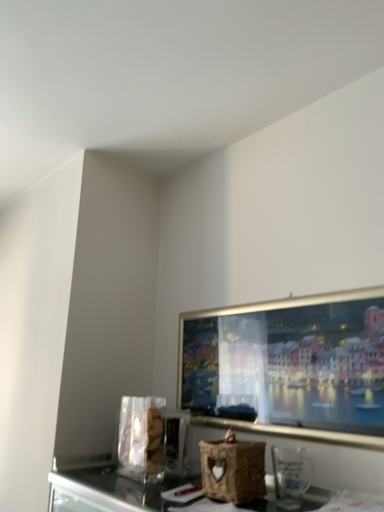
Question: Considering the relative sizes of woven brown basket at center and transparent glass at lower right in the image provided, is woven brown basket at center smaller than transparent glass at lower right?

Choices:
 (A) no
 (B) yes

Answer: (A)

Question: Considering the relative sizes of woven brown basket at center and transparent glass at lower right in the image provided, is woven brown basket at center bigger than transparent glass at lower right?

Choices:
 (A) yes
 (B) no

Answer: (A)

Question: Is woven brown basket at center next to transparent glass at lower right and touching it?

Choices:
 (A) no
 (B) yes

Answer: (A)

Question: From a real-world perspective, is woven brown basket at center on transparent glass at lower right?

Choices:
 (A) yes
 (B) no

Answer: (B)

Question: Can you confirm if woven brown basket at center is taller than transparent glass at lower right?

Choices:
 (A) yes
 (B) no

Answer: (A)

Question: Is woven brown basket at center not within transparent glass at lower right?

Choices:
 (A) yes
 (B) no

Answer: (A)

Question: Considering the relative sizes of transparent glass at lower right and woven brown basket at center in the image provided, is transparent glass at lower right wider than woven brown basket at center?

Choices:
 (A) no
 (B) yes

Answer: (A)

Question: From a real-world perspective, is transparent glass at lower right below woven brown basket at center?

Choices:
 (A) yes
 (B) no

Answer: (B)

Question: Is transparent glass at lower right not within woven brown basket at center?

Choices:
 (A) yes
 (B) no

Answer: (A)

Question: Does transparent glass at lower right lie behind woven brown basket at center?

Choices:
 (A) yes
 (B) no

Answer: (B)

Question: Is transparent glass at lower right next to woven brown basket at center?

Choices:
 (A) yes
 (B) no

Answer: (B)

Question: Would you say transparent glass at lower right contains woven brown basket at center?

Choices:
 (A) no
 (B) yes

Answer: (A)

Question: Considering the positions of transparent glass at lower right and woven brown basket at center in the image, is transparent glass at lower right taller or shorter than woven brown basket at center?

Choices:
 (A) tall
 (B) short

Answer: (B)